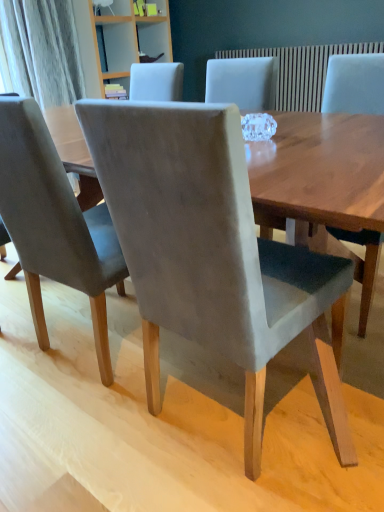
You are a GUI agent. You are given a task and a screenshot of the screen. Output one action in this format:
    pyautogui.click(x=<x>, y=<y>)
    Task: Click on the free location to the left of suede gray chair at center, acting as the third chair starting from the right
    This screenshot has height=512, width=384.
    Given the screenshot: What is the action you would take?
    pyautogui.click(x=28, y=334)